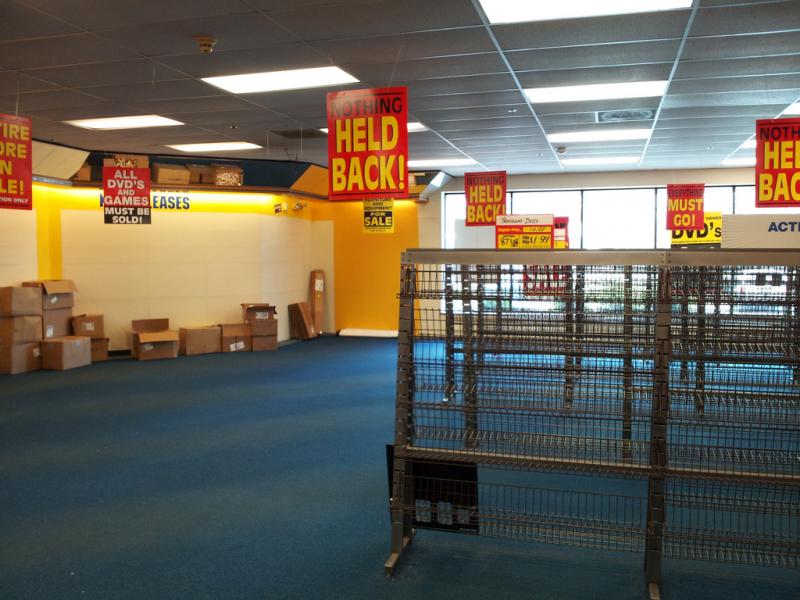
You are a GUI agent. You are given a task and a screenshot of the screen. Output one action in this format:
    pyautogui.click(x=<x>, y=<y>)
    Task: Click on the hanging ceiling
    This screenshot has width=800, height=600.
    Given the screenshot: What is the action you would take?
    pyautogui.click(x=602, y=56)